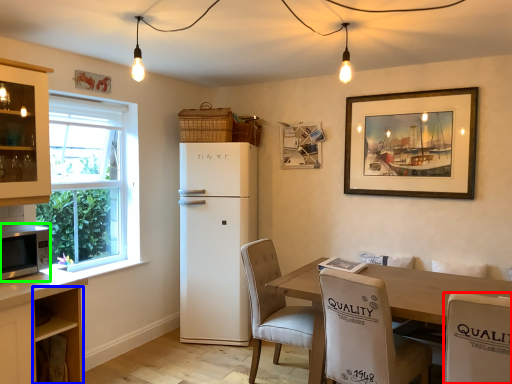
Question: Considering the real-world distances, which object is closest to chair (highlighted by a red box)? cabinetry (highlighted by a blue box) or microwave oven (highlighted by a green box).

Choices:
 (A) cabinetry
 (B) microwave oven

Answer: (A)